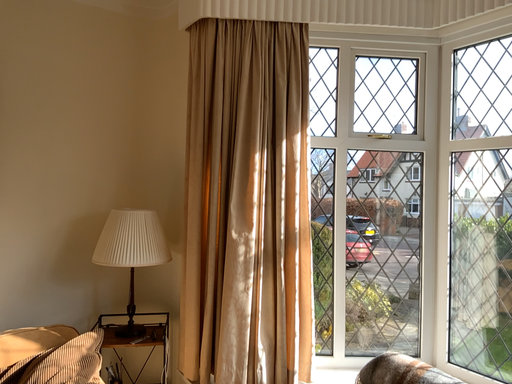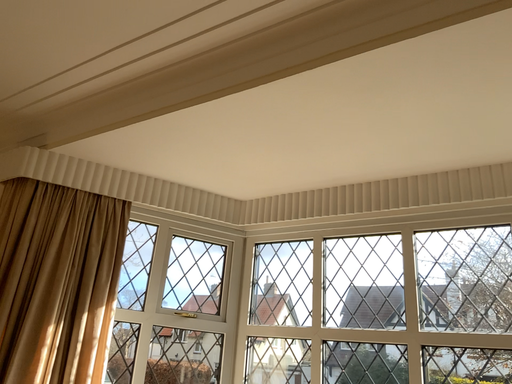
Question: How did the camera likely rotate when shooting the video?

Choices:
 (A) rotated right
 (B) rotated left

Answer: (A)